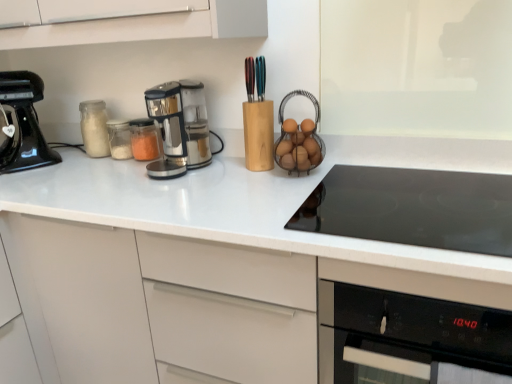
Question: From a real-world perspective, is translucent glass jar at left located higher than black glass cooktop at center?

Choices:
 (A) no
 (B) yes

Answer: (B)

Question: Can you confirm if translucent glass jar at left is shorter than black glass cooktop at center?

Choices:
 (A) yes
 (B) no

Answer: (B)

Question: Is translucent glass jar at left outside of black glass cooktop at center?

Choices:
 (A) yes
 (B) no

Answer: (A)

Question: From the image's perspective, is translucent glass jar at left below black glass cooktop at center?

Choices:
 (A) no
 (B) yes

Answer: (A)

Question: Does translucent glass jar at left lie behind black glass cooktop at center?

Choices:
 (A) no
 (B) yes

Answer: (B)

Question: Considering their positions, is white glossy countertop at center located in front of or behind black glass cooktop at center?

Choices:
 (A) behind
 (B) front

Answer: (B)

Question: From a real-world perspective, is white glossy countertop at center physically located above or below black glass cooktop at center?

Choices:
 (A) below
 (B) above

Answer: (A)

Question: Would you say white glossy countertop at center is inside or outside black glass cooktop at center?

Choices:
 (A) inside
 (B) outside

Answer: (B)

Question: Considering the positions of white glossy countertop at center and black glass cooktop at center in the image, is white glossy countertop at center bigger or smaller than black glass cooktop at center?

Choices:
 (A) small
 (B) big

Answer: (B)

Question: Is sleek metallic coffee maker at center, arranged as the 2th kitchen appliance when viewed from the left, inside or outside of black glass oven at lower right?

Choices:
 (A) outside
 (B) inside

Answer: (A)

Question: From a real-world perspective, is sleek metallic coffee maker at center, arranged as the 2th kitchen appliance when viewed from the left, above or below black glass oven at lower right?

Choices:
 (A) below
 (B) above

Answer: (B)

Question: Relative to black glass oven at lower right, is sleek metallic coffee maker at center, arranged as the 2th kitchen appliance when viewed from the left, in front or behind?

Choices:
 (A) behind
 (B) front

Answer: (A)

Question: Considering the relative positions of sleek metallic coffee maker at center, the first kitchen appliance viewed from the right, and black glass oven at lower right in the image provided, is sleek metallic coffee maker at center, the first kitchen appliance viewed from the right, to the left or to the right of black glass oven at lower right?

Choices:
 (A) right
 (B) left

Answer: (B)

Question: From the image's perspective, is translucent glass jar at left above or below white glossy countertop at center?

Choices:
 (A) below
 (B) above

Answer: (B)

Question: Is translucent glass jar at left bigger or smaller than white glossy countertop at center?

Choices:
 (A) small
 (B) big

Answer: (A)